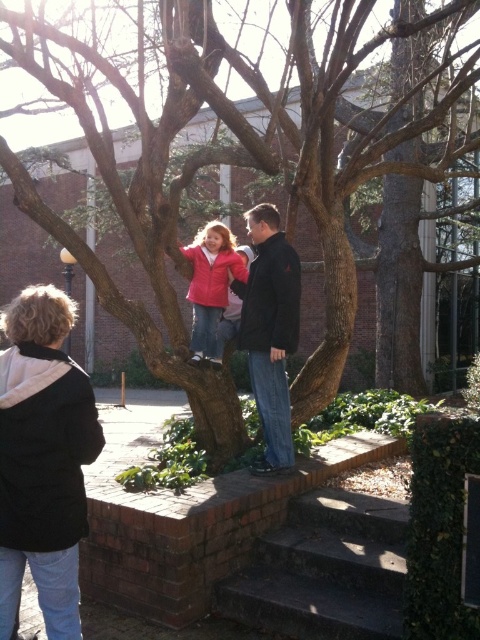
Consider the image. How distant is black fleece jacket at lower left from matte red jacket at center?

They are 8.04 feet apart.

Which is behind, point (35, 320) or point (196, 252)?

Point (196, 252)

Image resolution: width=480 pixels, height=640 pixels. I want to click on black fleece jacket at lower left, so click(43, 460).

Can you confirm if black fleece jacket at lower left is positioned below black matte jacket at center?

Indeed, black fleece jacket at lower left is positioned under black matte jacket at center.

Can you confirm if black fleece jacket at lower left is smaller than black matte jacket at center?

Indeed, black fleece jacket at lower left has a smaller size compared to black matte jacket at center.

Measure the distance between black fleece jacket at lower left and camera.

black fleece jacket at lower left and camera are 7.56 feet apart.

This screenshot has height=640, width=480. Identify the location of black fleece jacket at lower left. (43, 460).

Measure the distance between brown rough tree trunk at center and concrete stairs at lower center.

4.30 meters

Which is more to the right, brown rough tree trunk at center or concrete stairs at lower center?

concrete stairs at lower center

You are a GUI agent. You are given a task and a screenshot of the screen. Output one action in this format:
    pyautogui.click(x=<x>, y=<y>)
    Task: Click on the brown rough tree trunk at center
    
    Given the screenshot: What is the action you would take?
    pyautogui.click(x=241, y=161)